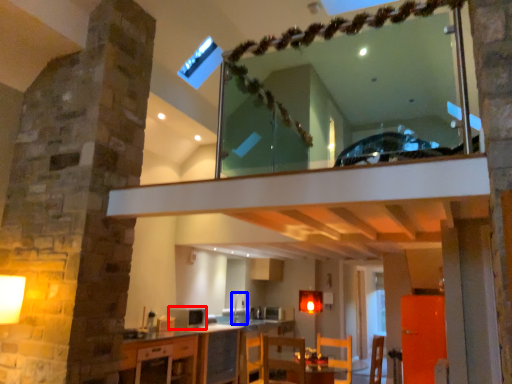
Question: Which of the following is the farthest to the observer, appliance (highlighted by a red box) or sink (highlighted by a blue box)?

Choices:
 (A) appliance
 (B) sink

Answer: (B)